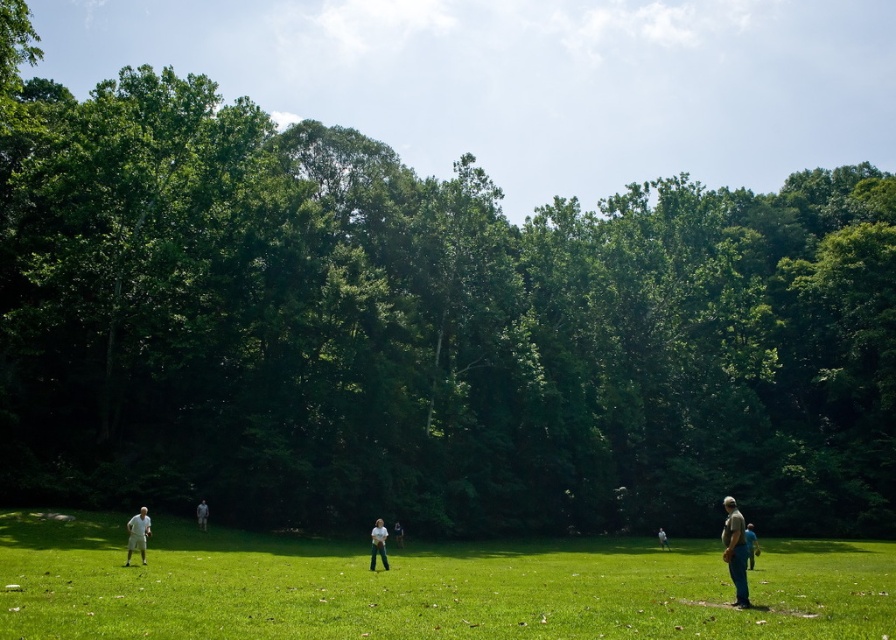
Does point (754, 564) come farther from viewer compared to point (395, 538)?

No, it is in front of (395, 538).

Can you confirm if blue fabric shirt at right is wider than white cotton shirt at center?

Yes.

The height and width of the screenshot is (640, 896). Find the location of `blue fabric shirt at right`. blue fabric shirt at right is located at coordinates (751, 545).

Where is `blue fabric shirt at right`? Image resolution: width=896 pixels, height=640 pixels. blue fabric shirt at right is located at coordinates (751, 545).

Does point (136, 522) lie in front of point (204, 515)?

Yes, point (136, 522) is closer to viewer.

Who is positioned more to the left, white cotton shirt at lower left or white fabric person at center?

white cotton shirt at lower left

Which is behind, point (134, 536) or point (205, 522)?

Positioned behind is point (205, 522).

Where is `white cotton shirt at lower left`? The height and width of the screenshot is (640, 896). white cotton shirt at lower left is located at coordinates (136, 534).

The width and height of the screenshot is (896, 640). I want to click on blue fabric shirt at right, so click(x=751, y=545).

Between blue fabric shirt at right and white fabric person at center, which one is positioned lower?

blue fabric shirt at right

What are the coordinates of `blue fabric shirt at right` in the screenshot? It's located at (751, 545).